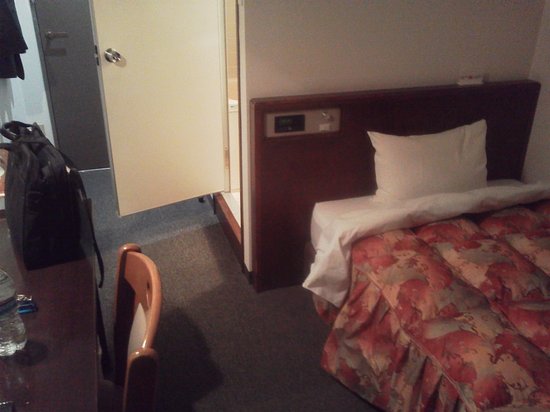
Find the location of a particular element. The image size is (550, 412). remote control is located at coordinates (469, 84).